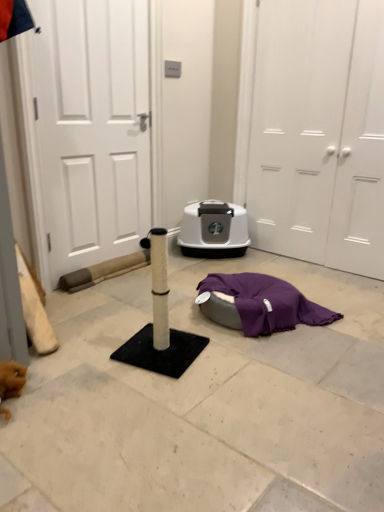
Question: Does white matte door at right, which appears as the 3th door when viewed from the left, have a larger size compared to white matte door at center, which appears as the second door when viewed from the left?

Choices:
 (A) yes
 (B) no

Answer: (B)

Question: Can you confirm if white matte door at right, the first door from the right, is positioned to the left of white matte door at center, which appears as the second door when viewed from the left?

Choices:
 (A) no
 (B) yes

Answer: (A)

Question: From the image's perspective, is white matte door at right, which appears as the 3th door when viewed from the left, under white matte door at center, the 2th door from the right?

Choices:
 (A) yes
 (B) no

Answer: (A)

Question: Can you confirm if white matte door at right, the first door from the right, is taller than white matte door at center, the 2th door from the right?

Choices:
 (A) no
 (B) yes

Answer: (A)

Question: Is the position of white matte door at right, which appears as the 3th door when viewed from the left, more distant than that of white matte door at center, the 2th door from the right?

Choices:
 (A) yes
 (B) no

Answer: (A)

Question: From a real-world perspective, is white matte door at right, the first door from the right, physically above white matte door at center, the 2th door from the right?

Choices:
 (A) yes
 (B) no

Answer: (B)

Question: Is white textured scratching post at center surrounded by purple fabric at lower center?

Choices:
 (A) no
 (B) yes

Answer: (A)

Question: Is the position of purple fabric at lower center more distant than that of white textured scratching post at center?

Choices:
 (A) yes
 (B) no

Answer: (A)

Question: Is purple fabric at lower center taller than white textured scratching post at center?

Choices:
 (A) yes
 (B) no

Answer: (A)

Question: Can you confirm if purple fabric at lower center is smaller than white textured scratching post at center?

Choices:
 (A) yes
 (B) no

Answer: (A)

Question: Can you confirm if purple fabric at lower center is thinner than white textured scratching post at center?

Choices:
 (A) yes
 (B) no

Answer: (A)

Question: Is purple fabric at lower center far away from white textured scratching post at center?

Choices:
 (A) no
 (B) yes

Answer: (A)

Question: Does white textured scratching post at center appear on the left side of white matte door at left, the 3th door from the right?

Choices:
 (A) no
 (B) yes

Answer: (A)